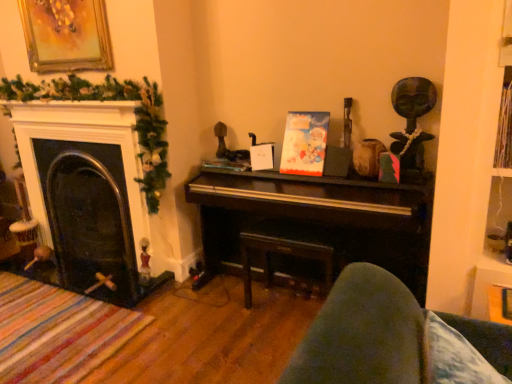
Question: Considering the relative positions of dark wood table at center and gold-framed painting at upper left in the image provided, is dark wood table at center to the left or to the right of gold-framed painting at upper left?

Choices:
 (A) right
 (B) left

Answer: (A)

Question: Relative to gold-framed painting at upper left, is dark wood table at center in front or behind?

Choices:
 (A) behind
 (B) front

Answer: (B)

Question: Which of these objects is positioned closest to the velvet blue cushion at lower right?

Choices:
 (A) black glass fireplace at left
 (B) gold-framed painting at upper left
 (C) shiny dark wood piano at center
 (D) dark wood table at center

Answer: (C)

Question: Which of these objects is positioned farthest from the black glass fireplace at left?

Choices:
 (A) dark wood table at center
 (B) shiny dark wood piano at center
 (C) velvet blue cushion at lower right
 (D) gold-framed painting at upper left

Answer: (C)